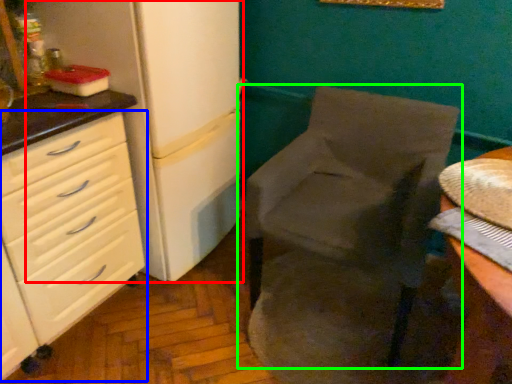
Question: Which object is the farthest from refrigerator (highlighted by a red box)? Choose among these: chest of drawers (highlighted by a blue box) or chair (highlighted by a green box).

Choices:
 (A) chest of drawers
 (B) chair

Answer: (B)